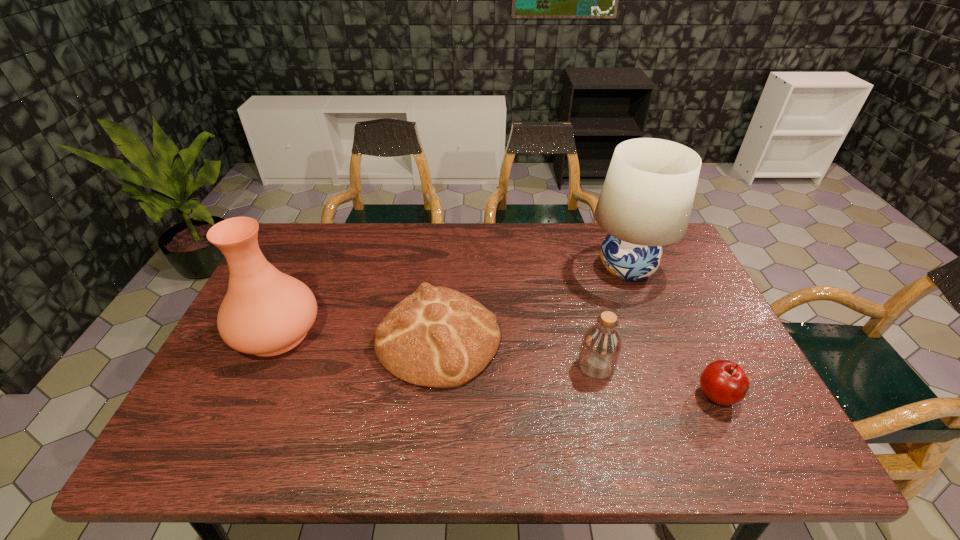
The width and height of the screenshot is (960, 540). What are the coordinates of `lampshade` in the screenshot? It's located at click(x=646, y=200).

Locate an element on the screen. The height and width of the screenshot is (540, 960). the leftmost object is located at coordinates (265, 312).

I want to click on bottle, so (x=601, y=346).

The height and width of the screenshot is (540, 960). In order to click on the second object from left to right in this screenshot , I will do `click(439, 338)`.

You are a GUI agent. You are given a task and a screenshot of the screen. Output one action in this format:
    pyautogui.click(x=<x>, y=<y>)
    Task: Click on the apple
    The height and width of the screenshot is (540, 960).
    Given the screenshot: What is the action you would take?
    pyautogui.click(x=723, y=382)

You are a GUI agent. You are given a task and a screenshot of the screen. Output one action in this format:
    pyautogui.click(x=<x>, y=<y>)
    Task: Click on the vacant position located 0.090m on the front-facing side of the lampshade
    The height and width of the screenshot is (540, 960).
    Given the screenshot: What is the action you would take?
    pyautogui.click(x=556, y=268)

Locate an element on the screen. vacant space located 0.150m on the front-facing side of the lampshade is located at coordinates (537, 268).

At what (x,y) coordinates should I click in order to perform the action: click on vacant space located 0.400m on the front-facing side of the lampshade. Please return your answer as a coordinate pair (x, y). Looking at the image, I should click on (456, 268).

Identify the location of vacant space located 0.280m on the back of the leftmost object. The height and width of the screenshot is (540, 960). (318, 243).

I want to click on blank space located on the front of the third shortest object, so click(x=620, y=463).